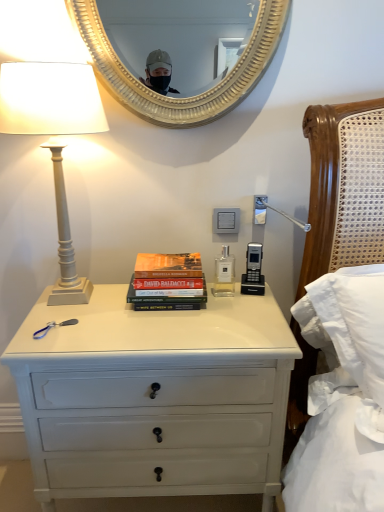
Image resolution: width=384 pixels, height=512 pixels. I want to click on empty space that is ontop of white painted wood chest of drawers at center, so click(168, 317).